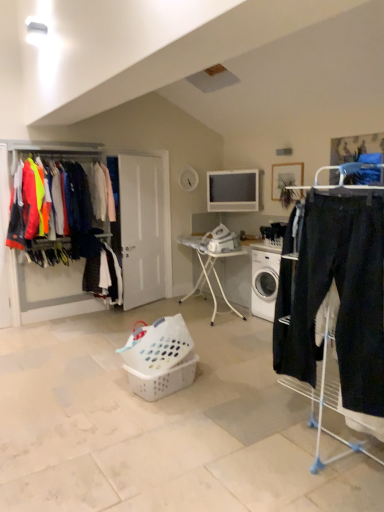
Describe the element at coordinates (285, 177) in the screenshot. This screenshot has height=512, width=384. I see `wooden picture frame at upper right` at that location.

Describe the element at coordinates (163, 379) in the screenshot. I see `white plastic basket at center, positioned as the first basket in bottom-to-top order` at that location.

What is the approximate width of matte black jacket at left, the 1th clothing when ordered from left to right?

It is 22.88 inches.

This screenshot has height=512, width=384. I want to click on matte black jacket at left, the 1th clothing when ordered from left to right, so click(76, 204).

The width and height of the screenshot is (384, 512). In order to click on wooden picture frame at upper right in this screenshot , I will do `click(285, 177)`.

Considering the relative sizes of white matte door at center and matte black jacket at left, the 1th clothing when ordered from left to right, in the image provided, is white matte door at center smaller than matte black jacket at left, the 1th clothing when ordered from left to right,?

Correct, white matte door at center occupies less space than matte black jacket at left, the 1th clothing when ordered from left to right.

Is point (129, 172) in front of point (72, 234)?

No, (129, 172) is further to viewer.

In terms of width, does white matte door at center look wider or thinner when compared to matte black jacket at left, which is counted as the 2th clothing, starting from the front?

Considering their sizes, white matte door at center looks slimmer than matte black jacket at left, which is counted as the 2th clothing, starting from the front.

From the image's perspective, is white matte door at center on matte black jacket at left, the 3th clothing from the right?

No.

Is white plastic basket at center, positioned as the first basket in bottom-to-top order, taller than white matte door at center?

In fact, white plastic basket at center, positioned as the first basket in bottom-to-top order, may be shorter than white matte door at center.

Starting from the white matte door at center, which basket is the 1st one in front? Please provide its 2D coordinates.

[(163, 379)]

Between white plastic basket at center, acting as the second basket starting from the top, and white matte door at center, which one has smaller width?

white matte door at center.

Could you tell me if white plastic basket at center, acting as the second basket starting from the top, is facing white matte door at center?

No, white plastic basket at center, acting as the second basket starting from the top, does not turn towards white matte door at center.

Considering the relative positions of white plastic basket at center, positioned as the first basket in bottom-to-top order, and white plastic laundry basket at center, which is the second basket from bottom to top, in the image provided, is white plastic basket at center, positioned as the first basket in bottom-to-top order, to the left or to the right of white plastic laundry basket at center, which is the second basket from bottom to top,?

white plastic basket at center, positioned as the first basket in bottom-to-top order, is to the right of white plastic laundry basket at center, which is the second basket from bottom to top.

From the image's perspective, is white plastic basket at center, acting as the second basket starting from the top, under white plastic laundry basket at center, which is the second basket from bottom to top?

Yes.

Is white plastic basket at center, acting as the second basket starting from the top, oriented away from white plastic laundry basket at center, which is the second basket from bottom to top?

white plastic basket at center, acting as the second basket starting from the top, is not turned away from white plastic laundry basket at center, which is the second basket from bottom to top.

Who is more distant, white plastic basket at center, acting as the second basket starting from the top, or white plastic laundry basket at center, which is the second basket from bottom to top?

white plastic basket at center, acting as the second basket starting from the top, is more distant.

Between matte gray tv at center and dark blue fabric pants at center, positioned as the first clothing in back-to-front order, which one is positioned in front?

dark blue fabric pants at center, positioned as the first clothing in back-to-front order, is in front.

Considering the sizes of objects matte gray tv at center and dark blue fabric pants at center, the 2th clothing positioned from the right, in the image provided, who is smaller, matte gray tv at center or dark blue fabric pants at center, the 2th clothing positioned from the right,?

matte gray tv at center is smaller.

Between matte gray tv at center and dark blue fabric pants at center, the 2th clothing positioned from the right, which one has more height?

dark blue fabric pants at center, the 2th clothing positioned from the right, is taller.

Considering the relative sizes of matte gray tv at center and dark blue fabric pants at center, the second clothing viewed from the left, in the image provided, is matte gray tv at center wider than dark blue fabric pants at center, the second clothing viewed from the left,?

No.

From the image's perspective, is white plastic laundry basket at center, which is the second basket from bottom to top, located beneath white plastic lampshade at upper center?

Yes, from the image's perspective, white plastic laundry basket at center, which is the second basket from bottom to top, is beneath white plastic lampshade at upper center.

Is white plastic laundry basket at center, which is the second basket from bottom to top, facing away from white plastic lampshade at upper center?

No, white plastic laundry basket at center, which is the second basket from bottom to top,'s orientation is not away from white plastic lampshade at upper center.

How distant is white plastic laundry basket at center, acting as the first basket starting from the top, from white plastic lampshade at upper center?

white plastic laundry basket at center, acting as the first basket starting from the top, is 9.44 feet from white plastic lampshade at upper center.

From their relative heights in the image, would you say white plastic laundry basket at center, which is the second basket from bottom to top, is taller or shorter than white plastic lampshade at upper center?

Clearly, white plastic laundry basket at center, which is the second basket from bottom to top, is taller compared to white plastic lampshade at upper center.

Is white plastic lampshade at upper center far from dark blue jeans at right, acting as the first clothing starting from the front?

white plastic lampshade at upper center is positioned a significant distance from dark blue jeans at right, acting as the first clothing starting from the front.

This screenshot has height=512, width=384. Identify the location of lamp on the left of dark blue jeans at right, acting as the first clothing starting from the front. (36, 31).

Which object is positioned more to the right, white plastic lampshade at upper center or dark blue jeans at right, acting as the first clothing starting from the front?

From the viewer's perspective, dark blue jeans at right, acting as the first clothing starting from the front, appears more on the right side.

Between white plastic laundry basket at center, acting as the first basket starting from the top, and dark blue jeans at right, acting as the first clothing starting from the front, which one has more height?

dark blue jeans at right, acting as the first clothing starting from the front, is taller.

Which point is more forward, (188, 347) or (289, 287)?

The point (289, 287) is in front.

Where is `clothing lying in front of the white plastic laundry basket at center, which is the second basket from bottom to top`? The height and width of the screenshot is (512, 384). clothing lying in front of the white plastic laundry basket at center, which is the second basket from bottom to top is located at coordinates (339, 297).

This screenshot has width=384, height=512. I want to click on door on the right of the matte black jacket at left, acting as the 2th clothing starting from the back, so click(x=141, y=229).

This screenshot has height=512, width=384. What are the coordinates of `door behind the white plastic basket at center, acting as the second basket starting from the top` in the screenshot? It's located at (141, 229).

From the image, which object appears to be nearer to white plastic laundry basket at center, acting as the first basket starting from the top, white metal ironing board at center or white matte door at center?

white metal ironing board at center is closer to white plastic laundry basket at center, acting as the first basket starting from the top.

When comparing their distances from white plastic lampshade at upper center, does white matte door at center or matte black jacket at left, acting as the 2th clothing starting from the back, seem further?

white matte door at center is positioned further to the anchor white plastic lampshade at upper center.

Considering their positions, is dark blue fabric pants at center, which is counted as the 3th clothing, starting from the front, positioned closer to white plastic laundry basket at center, which is the second basket from bottom to top, than matte gray tv at center?

The object closer to white plastic laundry basket at center, which is the second basket from bottom to top, is dark blue fabric pants at center, which is counted as the 3th clothing, starting from the front.

Considering their positions, is matte plastic clothes rack at left positioned closer to white matte door at center than white plastic lampshade at upper center?

matte plastic clothes rack at left is closer to white matte door at center.

Based on their spatial positions, is white plastic laundry basket at center, which is the second basket from bottom to top, or white metal ironing board at center further from wooden picture frame at upper right?

Based on the image, white plastic laundry basket at center, which is the second basket from bottom to top, appears to be further to wooden picture frame at upper right.

Considering their positions, is matte black jacket at left, the 3th clothing from the right, positioned further to wooden picture frame at upper right than matte plastic clothes rack at left?

matte black jacket at left, the 3th clothing from the right, is further to wooden picture frame at upper right.

From the image, which object appears to be nearer to white matte door at center, white metal ironing board at center or matte gray tv at center?

white metal ironing board at center is positioned closer to the anchor white matte door at center.

From the picture: From the image, which object appears to be farther from dark blue fabric pants at center, which is counted as the 3th clothing, starting from the front, white matte door at center or white plastic lampshade at upper center?

Among the two, white plastic lampshade at upper center is located further to dark blue fabric pants at center, which is counted as the 3th clothing, starting from the front.

Locate an element on the screen. This screenshot has width=384, height=512. desk between white plastic laundry basket at center, which is the second basket from bottom to top, and wooden picture frame at upper right in the front-back direction is located at coordinates (209, 269).

Where is `desk between white plastic basket at center, acting as the second basket starting from the top, and white matte door at center in the front-back direction`? This screenshot has width=384, height=512. desk between white plastic basket at center, acting as the second basket starting from the top, and white matte door at center in the front-back direction is located at coordinates (209, 269).

Where is `picture frame between dark blue jeans at right, placed as the third clothing when sorted from back to front, and matte gray tv at center, along the z-axis`? The width and height of the screenshot is (384, 512). picture frame between dark blue jeans at right, placed as the third clothing when sorted from back to front, and matte gray tv at center, along the z-axis is located at coordinates (285, 177).

You are a GUI agent. You are given a task and a screenshot of the screen. Output one action in this format:
    pyautogui.click(x=<x>, y=<y>)
    Task: Click on the basket between dark blue jeans at right, acting as the first clothing starting from the front, and white plastic basket at center, acting as the second basket starting from the top, from front to back
    The height and width of the screenshot is (512, 384).
    Given the screenshot: What is the action you would take?
    pyautogui.click(x=158, y=346)